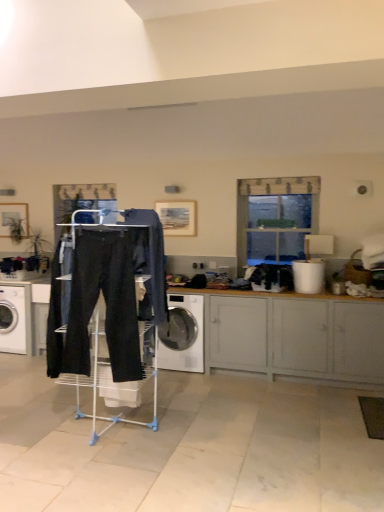
This screenshot has height=512, width=384. What do you see at coordinates (109, 310) in the screenshot?
I see `matte black pants at center` at bounding box center [109, 310].

Locate an element on the screen. matte black pants at center is located at coordinates (109, 310).

Measure the distance between white glossy washing machine at center, the 1th washing machine in the right-to-left sequence, and camera.

4.46 meters.

Measure the distance between point (x=292, y=340) and camera.

The distance of point (x=292, y=340) from camera is 4.25 meters.

You are a GUI agent. You are given a task and a screenshot of the screen. Output one action in this format:
    pyautogui.click(x=<x>, y=<y>)
    Task: Click on the clear glass window at upper center
    Image resolution: width=384 pixels, height=512 pixels.
    Given the screenshot: What is the action you would take?
    pyautogui.click(x=275, y=218)

The width and height of the screenshot is (384, 512). In order to click on black cotton sweat pants at center in this screenshot , I will do `click(105, 302)`.

This screenshot has width=384, height=512. Find the location of `matte black pants at center`. matte black pants at center is located at coordinates (109, 310).

Can you tell me how much black cotton sweat pants at center and white glossy washing machine at left, acting as the 2th washing machine starting from the right, differ in facing direction?

black cotton sweat pants at center and white glossy washing machine at left, acting as the 2th washing machine starting from the right, are facing 8.97 degrees away from each other.

Is black cotton sweat pants at center oriented towards white glossy washing machine at left, acting as the 2th washing machine starting from the right?

No.

Is the surface of black cotton sweat pants at center in direct contact with white glossy washing machine at left, acting as the 2th washing machine starting from the right?

No, black cotton sweat pants at center is not next to white glossy washing machine at left, acting as the 2th washing machine starting from the right.

Considering the positions of objects black cotton sweat pants at center and white glossy washing machine at left, acting as the 2th washing machine starting from the right, in the image provided, who is more to the right, black cotton sweat pants at center or white glossy washing machine at left, acting as the 2th washing machine starting from the right,?

From the viewer's perspective, black cotton sweat pants at center appears more on the right side.

Considering the points (176, 337) and (117, 325), which point is behind, point (176, 337) or point (117, 325)?

The point (176, 337) is farther from the camera.

From the picture: From the image's perspective, is white glossy washing machine at center, the 1th washing machine in the right-to-left sequence, on top of black cotton sweat pants at center?

No, from the image's perspective, white glossy washing machine at center, the 1th washing machine in the right-to-left sequence, is not on top of black cotton sweat pants at center.

In terms of size, does white glossy washing machine at center, the 1th washing machine in the right-to-left sequence, appear bigger or smaller than black cotton sweat pants at center?

Considering their sizes, white glossy washing machine at center, the 1th washing machine in the right-to-left sequence, takes up more space than black cotton sweat pants at center.

Could you tell me if white glossy washing machine at center, which is the second washing machine in left-to-right order, is turned towards black cotton sweat pants at center?

Yes, white glossy washing machine at center, which is the second washing machine in left-to-right order, faces towards black cotton sweat pants at center.

Who is more distant, white glossy washing machine at left, the 1th washing machine viewed from the left, or matte gray cabinet at lower right?

white glossy washing machine at left, the 1th washing machine viewed from the left, is further from the camera.

Is point (26, 345) positioned behind point (210, 355)?

Yes, point (26, 345) is behind point (210, 355).

Is matte gray cabinet at lower right at the back of white glossy washing machine at left, acting as the 2th washing machine starting from the right?

No, white glossy washing machine at left, acting as the 2th washing machine starting from the right,'s orientation is not away from matte gray cabinet at lower right.

Which object is wider, white glossy washing machine at left, the 1th washing machine viewed from the left, or matte black pants at center?

matte black pants at center.

Would you say white glossy washing machine at left, the 1th washing machine viewed from the left, is to the left or to the right of matte black pants at center in the picture?

white glossy washing machine at left, the 1th washing machine viewed from the left, is positioned on matte black pants at center's left side.

Looking at this image, relative to matte black pants at center, is white glossy washing machine at left, the 1th washing machine viewed from the left, in front or behind?

Visually, white glossy washing machine at left, the 1th washing machine viewed from the left, is located behind matte black pants at center.

From the matte black pants at center, count 2nd washing machines backward and point to it. Please provide its 2D coordinates.

[(22, 314)]

Considering the points (241, 297) and (243, 189), which point is in front, point (241, 297) or point (243, 189)?

The point (241, 297) is more forward.

From their relative heights in the image, would you say matte gray cabinet at lower right is taller or shorter than clear glass window at upper center?

Clearly, matte gray cabinet at lower right is shorter compared to clear glass window at upper center.

Which object is positioned more to the left, matte gray cabinet at lower right or clear glass window at upper center?

Positioned to the left is matte gray cabinet at lower right.

Considering the sizes of objects matte gray cabinet at lower right and clear glass window at upper center in the image provided, who is thinner, matte gray cabinet at lower right or clear glass window at upper center?

clear glass window at upper center.

Considering the sizes of black cotton sweat pants at center and dark blue denim jeans at center in the image, is black cotton sweat pants at center taller or shorter than dark blue denim jeans at center?

Clearly, black cotton sweat pants at center is taller compared to dark blue denim jeans at center.

Considering the relative sizes of black cotton sweat pants at center and dark blue denim jeans at center in the image provided, is black cotton sweat pants at center thinner than dark blue denim jeans at center?

Correct, the width of black cotton sweat pants at center is less than that of dark blue denim jeans at center.

Does point (103, 292) appear closer or farther from the camera than point (161, 303)?

Point (103, 292) is closer to the camera than point (161, 303).

In order to click on clothing that appears behind the black cotton sweat pants at center in this screenshot , I will do `click(153, 257)`.

Is dark blue denim jeans at center behind black cotton sweat pants at center?

Yes, dark blue denim jeans at center is behind black cotton sweat pants at center.

From the image's perspective, would you say dark blue denim jeans at center is shown under black cotton sweat pants at center?

Incorrect, from the image's perspective, dark blue denim jeans at center is higher than black cotton sweat pants at center.

What's the angular difference between dark blue denim jeans at center and black cotton sweat pants at center's facing directions?

The facing directions of dark blue denim jeans at center and black cotton sweat pants at center are 81.9 degrees apart.

The image size is (384, 512). In order to click on sweat pant above the white glossy washing machine at left, acting as the 2th washing machine starting from the right (from a real-world perspective) in this screenshot , I will do `click(105, 302)`.

Where is `sweat pant located on the left of white glossy washing machine at center, which is the second washing machine in left-to-right order`? sweat pant located on the left of white glossy washing machine at center, which is the second washing machine in left-to-right order is located at coordinates (105, 302).

Based on their spatial positions, is matte gray cabinet at lower right or black cotton sweat pants at center further from dark blue denim jeans at center?

matte gray cabinet at lower right.

Based on their spatial positions, is clear glass window at upper center or black cotton sweat pants at center further from white glossy washing machine at left, acting as the 2th washing machine starting from the right?

clear glass window at upper center.

From the image, which object appears to be farther from white glossy washing machine at center, the 1th washing machine in the right-to-left sequence, matte gray cabinet at lower right or white glossy washing machine at left, acting as the 2th washing machine starting from the right?

white glossy washing machine at left, acting as the 2th washing machine starting from the right, is further to white glossy washing machine at center, the 1th washing machine in the right-to-left sequence.

When comparing their distances from black cotton sweat pants at center, does matte black pants at center or matte gray cabinet at lower right seem closer?

matte black pants at center is closer to black cotton sweat pants at center.

When comparing their distances from white glossy washing machine at left, acting as the 2th washing machine starting from the right, does matte gray cabinet at lower right or matte black pants at center seem closer?

matte black pants at center lies closer to white glossy washing machine at left, acting as the 2th washing machine starting from the right, than the other object.

From the image, which object appears to be farther from dark blue denim jeans at center, clear glass window at upper center or black cotton sweat pants at center?

clear glass window at upper center.

Based on their spatial positions, is white glossy washing machine at center, the 1th washing machine in the right-to-left sequence, or matte gray cabinet at lower right closer to clear glass window at upper center?

Among the two, matte gray cabinet at lower right is located nearer to clear glass window at upper center.

Based on the photo, looking at the image, which one is located closer to white glossy washing machine at left, acting as the 2th washing machine starting from the right, black cotton sweat pants at center or matte gray cabinet at lower right?

Among the two, black cotton sweat pants at center is located nearer to white glossy washing machine at left, acting as the 2th washing machine starting from the right.

This screenshot has height=512, width=384. I want to click on cabinetry positioned between matte black pants at center and clear glass window at upper center from near to far, so click(293, 336).

You are a GUI agent. You are given a task and a screenshot of the screen. Output one action in this format:
    pyautogui.click(x=<x>, y=<y>)
    Task: Click on the washing machine located between white glossy washing machine at left, the 1th washing machine viewed from the left, and matte gray cabinet at lower right in the left-right direction
    
    Given the screenshot: What is the action you would take?
    pyautogui.click(x=183, y=335)

At what (x,y) coordinates should I click in order to perform the action: click on clothing between black cotton sweat pants at center and clear glass window at upper center from front to back. Please return your answer as a coordinate pair (x, y). Image resolution: width=384 pixels, height=512 pixels. Looking at the image, I should click on point(153,257).

At what (x,y) coordinates should I click in order to perform the action: click on closet between black cotton sweat pants at center and white glossy washing machine at left, acting as the 2th washing machine starting from the right, from front to back. Please return your answer as a coordinate pair (x, y). This screenshot has height=512, width=384. Looking at the image, I should click on (x=109, y=310).